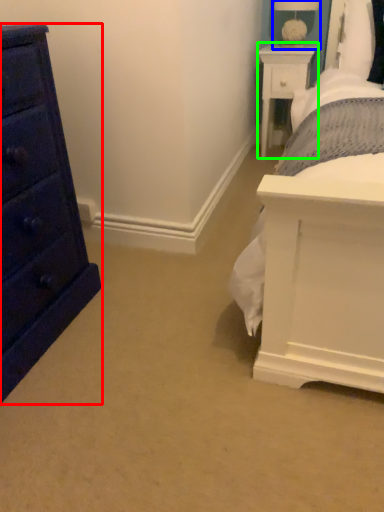
Question: Based on their relative distances, which object is nearer to chest of drawers (highlighted by a red box)? Choose from table lamp (highlighted by a blue box) and nightstand (highlighted by a green box).

Choices:
 (A) table lamp
 (B) nightstand

Answer: (B)